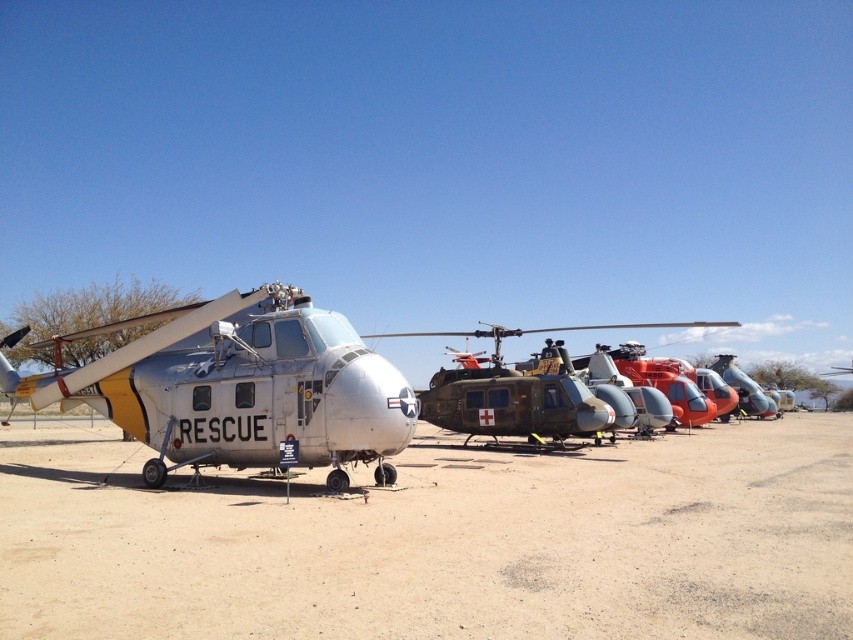
Based on the photo, between silver metallic helicopter at center and metallic green helicopter at center, which one has less height?

silver metallic helicopter at center is shorter.

This screenshot has height=640, width=853. What do you see at coordinates (242, 387) in the screenshot? I see `silver metallic helicopter at center` at bounding box center [242, 387].

Is point (236, 420) farther from camera compared to point (590, 392)?

No, (236, 420) is in front of (590, 392).

Where is `silver metallic helicopter at center`? This screenshot has width=853, height=640. silver metallic helicopter at center is located at coordinates (242, 387).

Can you confirm if dirt field at center is positioned to the right of metallic green helicopter at center?

No, dirt field at center is not to the right of metallic green helicopter at center.

Can you confirm if dirt field at center is wider than metallic green helicopter at center?

In fact, dirt field at center might be narrower than metallic green helicopter at center.

Does point (648, 566) come behind point (523, 422)?

No, it is in front of (523, 422).

This screenshot has width=853, height=640. I want to click on dirt field at center, so click(x=439, y=541).

Between dirt field at center and silver metallic helicopter at center, which one has less height?

Standing shorter between the two is silver metallic helicopter at center.

Between point (309, 524) and point (381, 480), which one is positioned in front?

Positioned in front is point (309, 524).

Locate an element on the screen. Image resolution: width=853 pixels, height=640 pixels. dirt field at center is located at coordinates (439, 541).